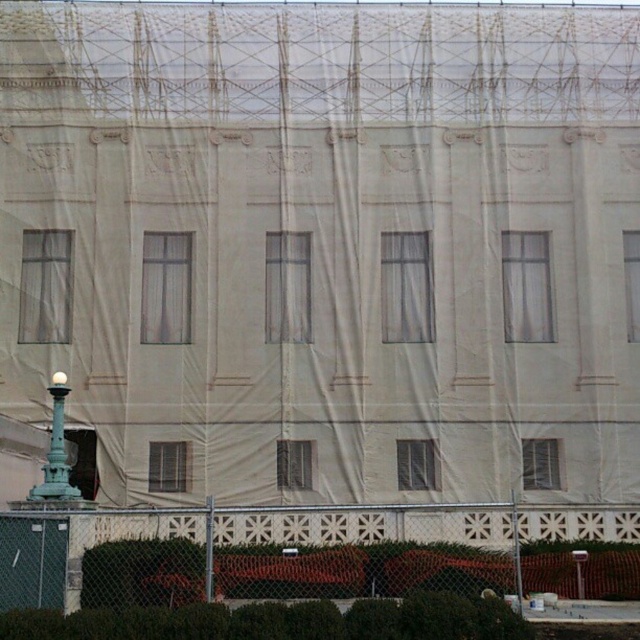
You are standing in front of the building and want to know if the point at location (352, 564) is closer to you than the point at (52, 483). Based on the image, can you determine which point is closer?

Yes, according to the image description, point (352, 564) is in front of point (52, 483), so it is closer to you.